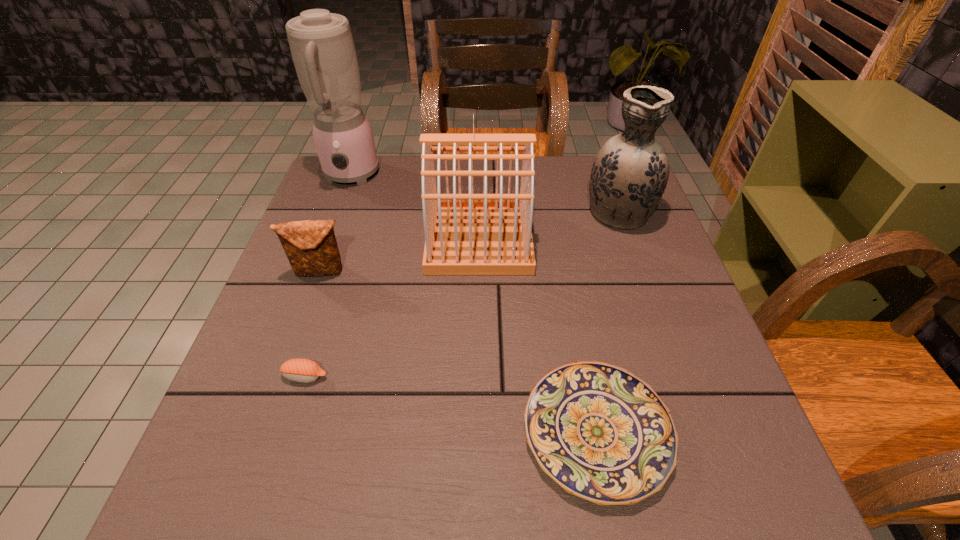
Image resolution: width=960 pixels, height=540 pixels. Find the location of `free space that satisfies the following two spatial constraints: 1. on the back side of the plate; 2. with an open door on the birdcage`. free space that satisfies the following two spatial constraints: 1. on the back side of the plate; 2. with an open door on the birdcage is located at coordinates (560, 239).

Identify the location of vacant position in the image that satisfies the following two spatial constraints: 1. with an open door on the birdcage; 2. on the open side of the clutch bag. (479, 272).

The image size is (960, 540). Find the location of `free space that satisfies the following two spatial constraints: 1. on the base of the shortest object near the control knob; 2. on the left side of the food processor`. free space that satisfies the following two spatial constraints: 1. on the base of the shortest object near the control knob; 2. on the left side of the food processor is located at coordinates coord(257,431).

Find the location of a particular element. This screenshot has height=540, width=960. free space that satisfies the following two spatial constraints: 1. on the base of the sushi near the control knob; 2. on the left side of the tallest object is located at coordinates (277, 376).

Where is `vacant region that satisfies the following two spatial constraints: 1. with an open door on the birdcage; 2. on the open side of the third shortest object`? This screenshot has height=540, width=960. vacant region that satisfies the following two spatial constraints: 1. with an open door on the birdcage; 2. on the open side of the third shortest object is located at coordinates (479, 272).

You are a GUI agent. You are given a task and a screenshot of the screen. Output one action in this format:
    pyautogui.click(x=<x>, y=<y>)
    Task: Click on the vacant position in the image that satisfies the following two spatial constraints: 1. on the open side of the second shortest object; 2. on the left side of the clutch bag
    This screenshot has height=540, width=960.
    Given the screenshot: What is the action you would take?
    pyautogui.click(x=284, y=376)

At what (x,y) coordinates should I click in order to perform the action: click on vacant point that satisfies the following two spatial constraints: 1. with an open door on the birdcage; 2. on the open side of the clutch bag. Please return your answer as a coordinate pair (x, y). Looking at the image, I should click on (479, 272).